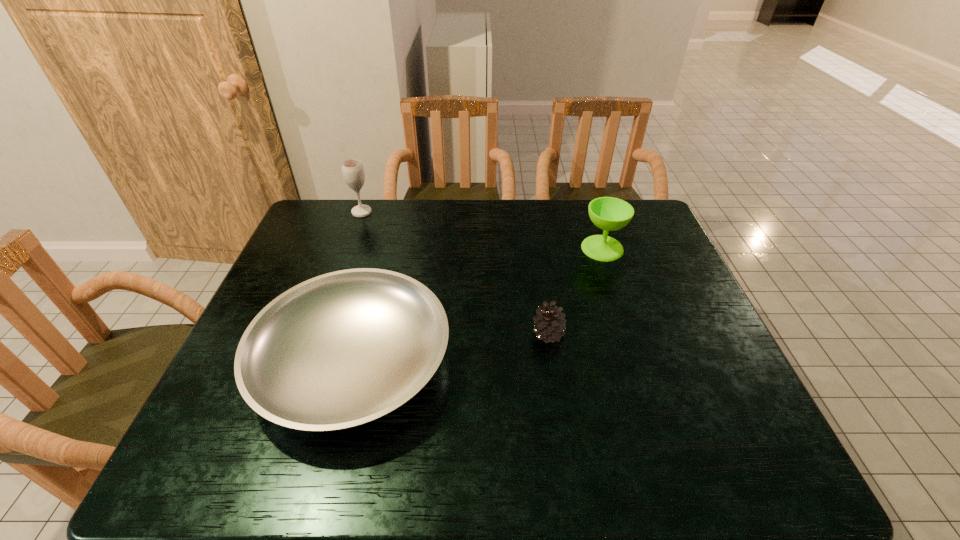
I want to click on the farthest object, so click(x=353, y=172).

The image size is (960, 540). Find the location of `the tallest object`. the tallest object is located at coordinates (353, 172).

Image resolution: width=960 pixels, height=540 pixels. What are the coordinates of `the right wineglass` in the screenshot? It's located at (608, 213).

Find the location of a particular element. the nearer wineglass is located at coordinates (608, 213).

Where is `pinecone`? pinecone is located at coordinates (550, 327).

Where is `bedpan`? The width and height of the screenshot is (960, 540). bedpan is located at coordinates (340, 350).

You are a GUI agent. You are given a task and a screenshot of the screen. Output one action in this format:
    pyautogui.click(x=<x>, y=<y>)
    Task: Click on the vacant position located on the front of the taller wineglass
    The width and height of the screenshot is (960, 540).
    Given the screenshot: What is the action you would take?
    pyautogui.click(x=341, y=269)

Where is `free region located 0.180m on the left of the shorter wineglass`? The height and width of the screenshot is (540, 960). free region located 0.180m on the left of the shorter wineglass is located at coordinates (523, 248).

At what (x,y) coordinates should I click in order to perform the action: click on blank area located 0.310m on the left of the third object from left to right. Please return your answer as a coordinate pair (x, y). Image resolution: width=960 pixels, height=540 pixels. Looking at the image, I should click on (409, 334).

Where is `free region located on the back of the bedpan`? The width and height of the screenshot is (960, 540). free region located on the back of the bedpan is located at coordinates (388, 230).